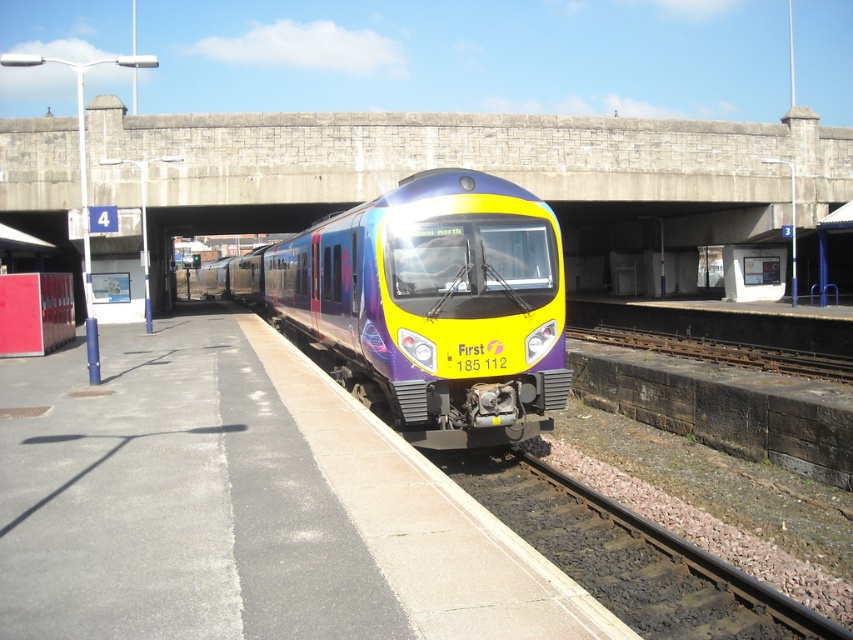
You are a maintenance worker needing to place a 3 meter long equipment on the platform. Given the sizes of the smooth concrete platform at center and the black gravel train track at lower center, will there be enough space on the platform to place the equipment without overlapping the track?

The smooth concrete platform at center has a larger size compared to black gravel train track at lower center, so there should be sufficient space to place the 3 meter long equipment on the platform without overlapping the track.

You are standing at the train station platform and want to find the black gravel train track at lower center. According to the scene description, where exactly is it positioned?

The black gravel train track at lower center is located at point (630,556).